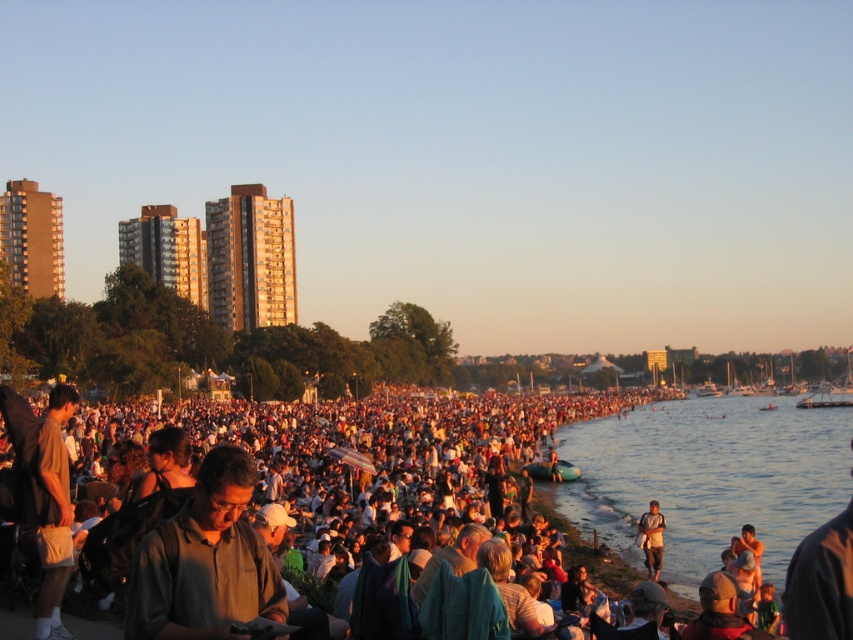
You are standing at the beach and want to take a photo of both point (210, 410) and point (656, 541) in the scene. Which point should you focus on first to ensure both are in clear view?

You should focus on point (210, 410) first because it is closer to the camera than point (656, 541), ensuring both points are in focus.

You are standing at the center of the beach scene and want to locate the clear water at lower right. Based on the coordinates given, in which general direction should you look to find it?

The clear water at lower right is located at coordinates point (708, 477), so you should look towards the lower right direction to find it.

Looking at this image, you are a photographer positioned at the center of the beach, aiming to capture both the point at coordinates point (776, 490) and point (641, 525) in a single frame. Which point should you focus on first to ensure both are in focus?

You should focus on point (776, 490) first because it is closer to you than point (641, 525), ensuring both points are within the depth of field.